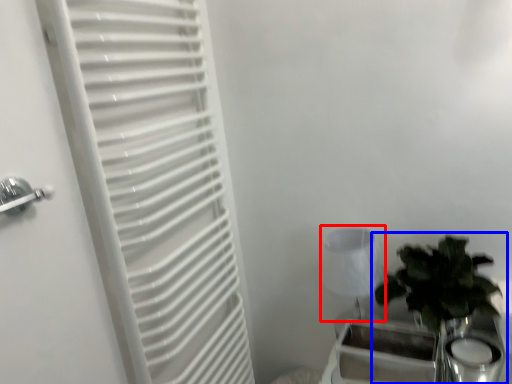
Question: Which point is closer to the camera, lamp (highlighted by a red box) or houseplant (highlighted by a blue box)?

Choices:
 (A) lamp
 (B) houseplant

Answer: (B)